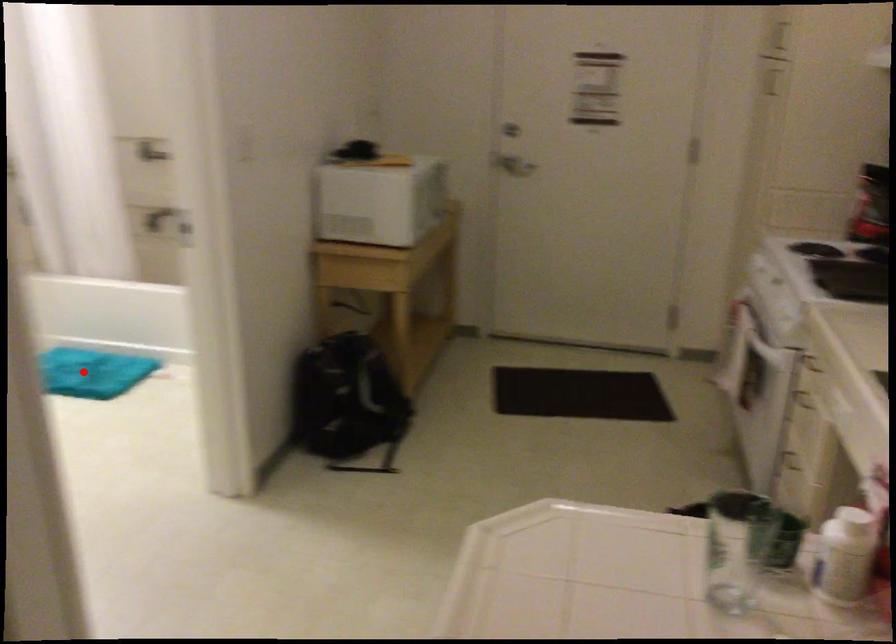
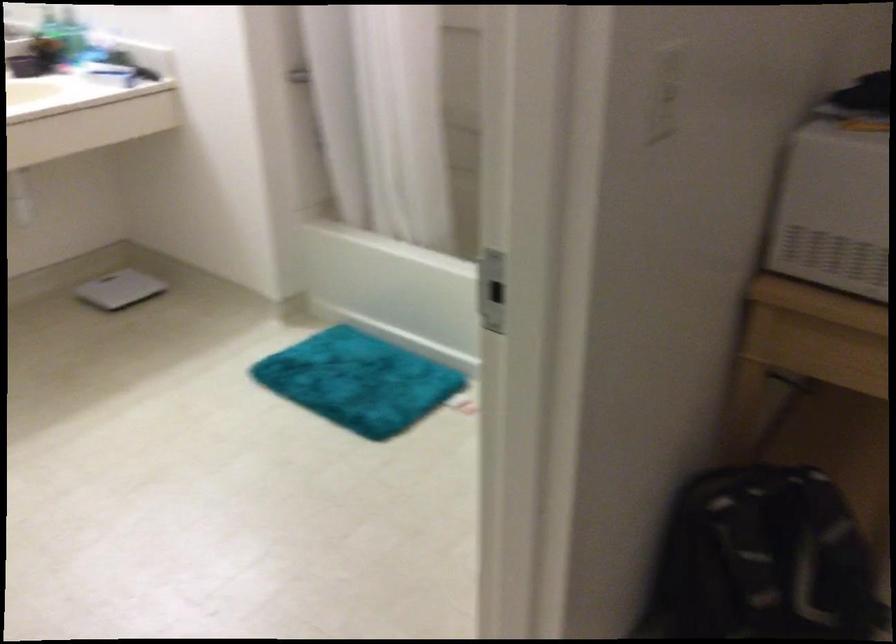
Question: A red point is marked in image1. In image2, is the corresponding 3D point closer to the camera or farther? Reply with the corresponding letter.

Choices:
 (A) The corresponding 3D point is closer.
 (B) The corresponding 3D point is farther.

Answer: (A)